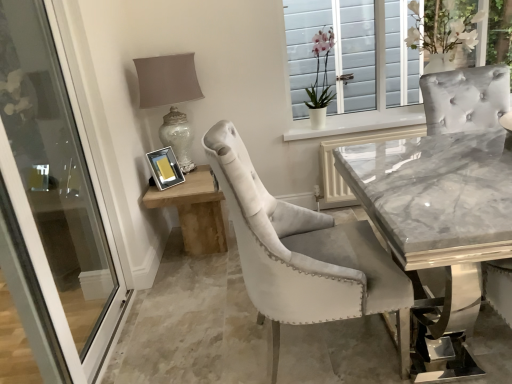
Where is `free space in front of metallic silver picture frame at upper center`? free space in front of metallic silver picture frame at upper center is located at coordinates (163, 192).